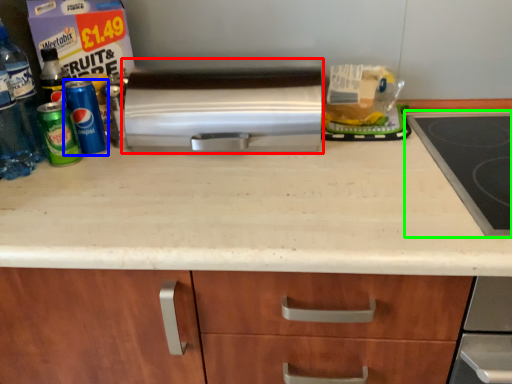
Question: Which object is positioned closest to kitchen appliance (highlighted by a red box)? Select from beverage (highlighted by a blue box) and gas stove (highlighted by a green box).

Choices:
 (A) beverage
 (B) gas stove

Answer: (A)